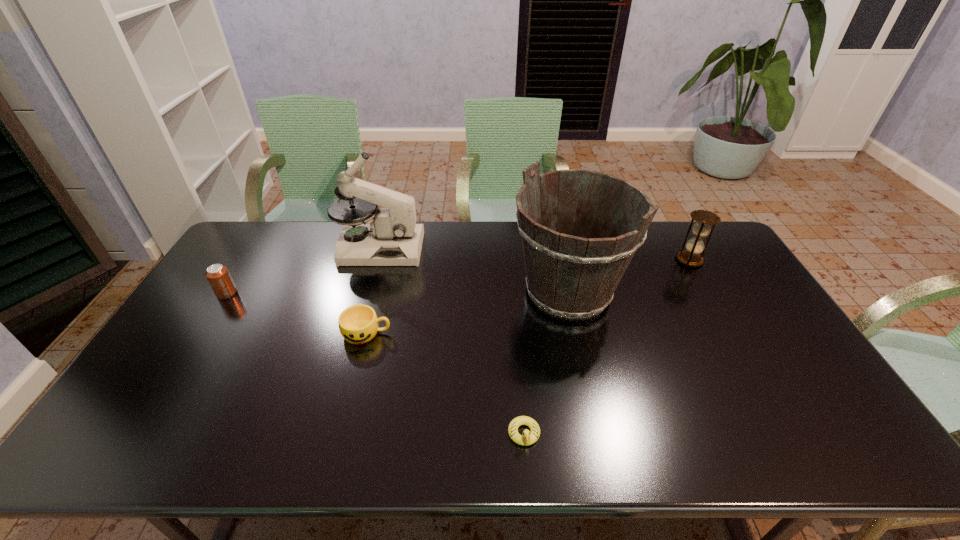
Where is `free spot that satisfies the following two spatial constraints: 1. at the eyepiece of the microscope; 2. on the right side of the fifth tallest object`? The width and height of the screenshot is (960, 540). free spot that satisfies the following two spatial constraints: 1. at the eyepiece of the microscope; 2. on the right side of the fifth tallest object is located at coordinates (356, 333).